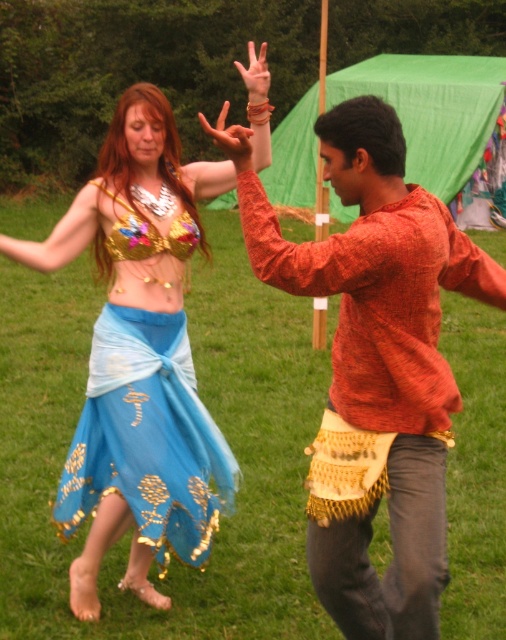
You are a photographer taking a picture of the two dancers in the scene. You notice the orange woven shirt at center and the matte gold bra at center. Which object should you focus on if you want to capture the one that is on the right side?

The orange woven shirt at center is positioned on the right side of the matte gold bra at center, so you should focus on the orange woven shirt at center to capture the one on the right.

You are a photographer setting up a shot of the two dancers. You want to ensure the green grass at center and the matte gold bra at center are both visible in the frame. Based on their positions, which object should you focus on first to capture both in focus?

The green grass at center is positioned over matte gold bra at center, so focusing on the green grass at center first will help ensure both are in focus since it is closer to the camera.